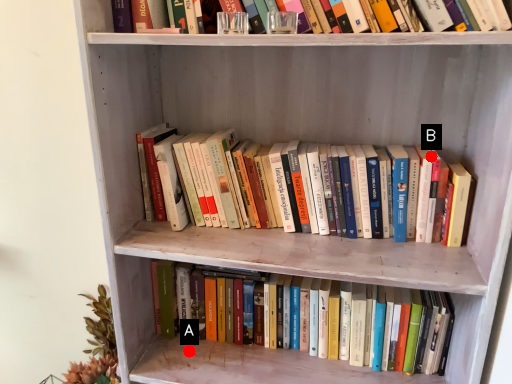
Question: Two points are circled on the image, labeled by A and B beside each circle. Which point is further to the camera?

Choices:
 (A) A is further
 (B) B is further

Answer: (A)